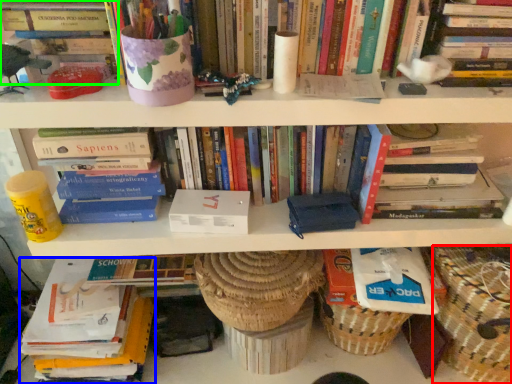
Question: Considering the real-world distances, which object is closest to basket (highlighted by a red box)? book (highlighted by a blue box) or book (highlighted by a green box).

Choices:
 (A) book
 (B) book

Answer: (A)